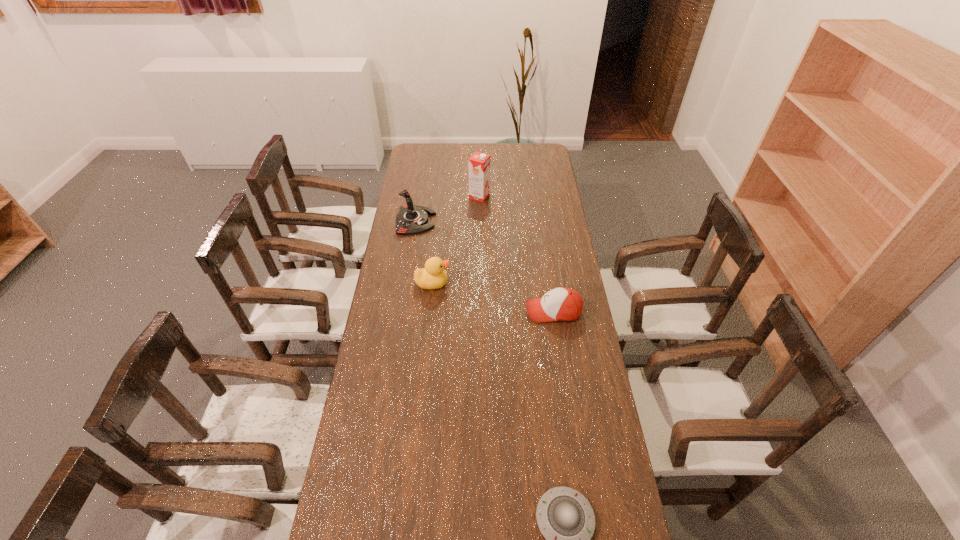
In order to click on free space between the fourth tallest object and the farthest object in this screenshot , I will do `click(516, 254)`.

The width and height of the screenshot is (960, 540). I want to click on vacant area between the duck and the carton, so click(456, 240).

The image size is (960, 540). In order to click on free space between the joystick and the third farthest object in this screenshot , I will do `click(424, 252)`.

I want to click on vacant area that lies between the third farthest object and the carton, so click(x=456, y=240).

This screenshot has width=960, height=540. What are the coordinates of `unoccupied area between the third object from right to left and the baseball cap` in the screenshot? It's located at (516, 254).

Identify which object is located as the third nearest to the tallest object. Please provide its 2D coordinates. Your answer should be formatted as a tuple, i.e. [(x, y)], where the tuple contains the x and y coordinates of a point satisfying the conditions above.

[(563, 304)]

Identify which object is the third nearest to the fourth farthest object. Please provide its 2D coordinates. Your answer should be formatted as a tuple, i.e. [(x, y)], where the tuple contains the x and y coordinates of a point satisfying the conditions above.

[(565, 518)]

You are a GUI agent. You are given a task and a screenshot of the screen. Output one action in this format:
    pyautogui.click(x=<x>, y=<y>)
    Task: Click on the free location that satisfies the following two spatial constraints: 1. on the front side of the farthest object; 2. at the beak of the third tallest object
    This screenshot has height=540, width=960.
    Given the screenshot: What is the action you would take?
    pyautogui.click(x=479, y=283)